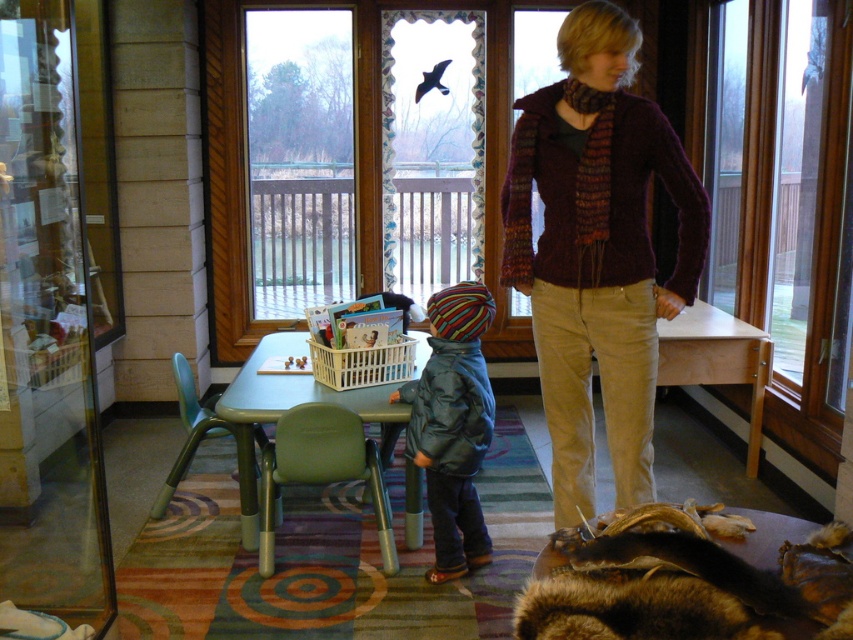
You are standing in the room and want to exit through the transparent glass screen door at left. Based on the coordinates provided, is the door positioned near the bottom or top of the image?

The transparent glass screen door at left is located at point coordinates of 0.520 on the x axis and 0.055 on the y axis. Since the y coordinate is closer to 0.0, which typically represents the bottom of an image, the door is positioned near the bottom of the image.

You are a visitor in the museum and want to place your blue waterproof jacket at center on a chair. Which chair should you choose between the blue chair and the green chair?

The blue waterproof jacket at center is located at point coordinates that are not directly related to the chairs. The question should focus on spatial relationships between the jacket and chairs. Please provide more details about the positions of the chairs relative to the jacket.